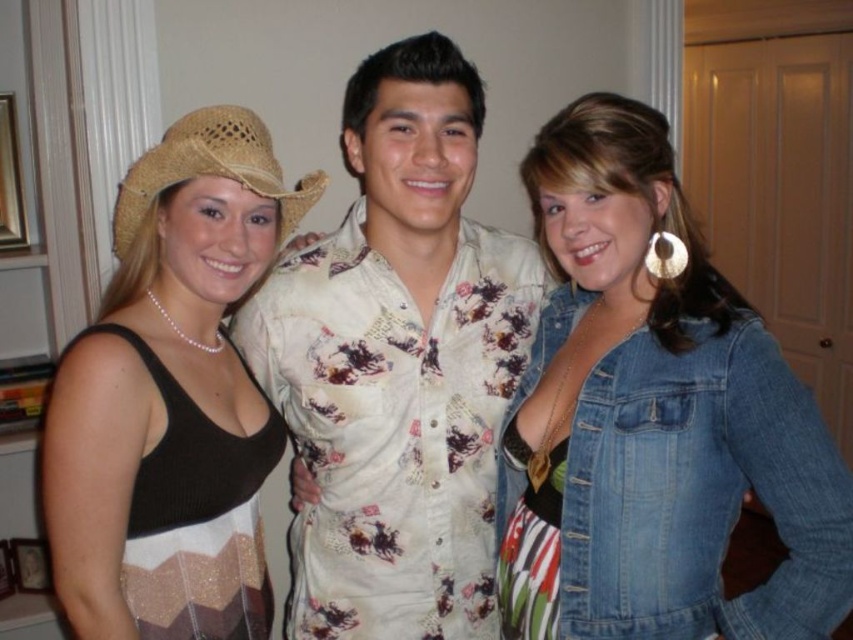
You are a photographer trying to arrange the subjects for a photo shoot. You need to ensure that the matte straw cowboy hat at left and the black knitted dress at left are positioned so that the dress is to the right of the hat. Are they currently arranged this way?

Yes, the matte straw cowboy hat at left is to the left of the black knitted dress at left, so the dress is already positioned to the right of the hat.

You are trying to decide whether to place a new plant pot between the denim jacket at lower right and the strawhat at left. Based on their heights, which object should the plant pot be placed closer to for stability?

The denim jacket at lower right is taller than the strawhat at left, so placing the plant pot closer to the denim jacket at lower right would provide better stability due to its height.

You are a photographer standing 5 feet away from the camera. You want to take a photo of the black knitted dress at left. Can you reach the camera without moving from your current position?

The black knitted dress at left and camera are 3.75 feet apart from each other. Since you are 5 feet away from the camera, you are farther than the distance between the dress and the camera. Therefore, you cannot reach the camera to take the photo without moving.